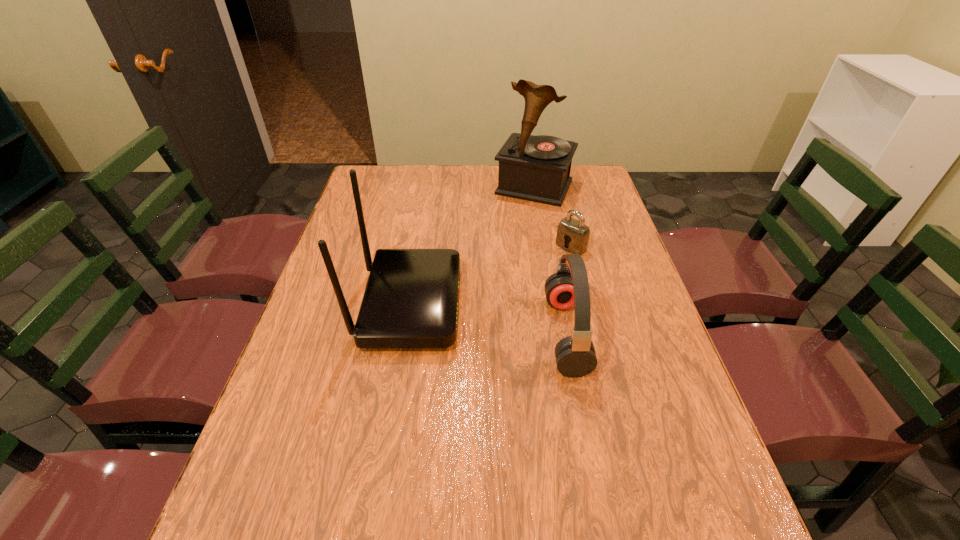
Locate an element on the screen. Image resolution: width=960 pixels, height=540 pixels. vacant space at the far edge of the desktop is located at coordinates (453, 194).

Identify the location of vacant space at the near edge of the desktop. (348, 469).

Where is `vacant position at the left edge of the desktop`? Image resolution: width=960 pixels, height=540 pixels. vacant position at the left edge of the desktop is located at coordinates (312, 360).

Locate an element on the screen. free region at the right edge of the desktop is located at coordinates (623, 411).

Image resolution: width=960 pixels, height=540 pixels. Identify the location of vacant point located between the third tallest object and the leftmost object. (488, 319).

The width and height of the screenshot is (960, 540). I want to click on free point between the third nearest object and the farthest object, so click(553, 217).

Where is `empty location between the phonograph_record and the padlock`? empty location between the phonograph_record and the padlock is located at coordinates (553, 217).

This screenshot has height=540, width=960. I want to click on free point between the padlock and the leftmost object, so click(x=491, y=275).

At what (x,y) coordinates should I click in order to perform the action: click on blank region between the router and the second farthest object. Please return your answer as a coordinate pair (x, y). This screenshot has height=540, width=960. Looking at the image, I should click on (491, 275).

Locate an element on the screen. The image size is (960, 540). free space between the router and the shortest object is located at coordinates (491, 275).